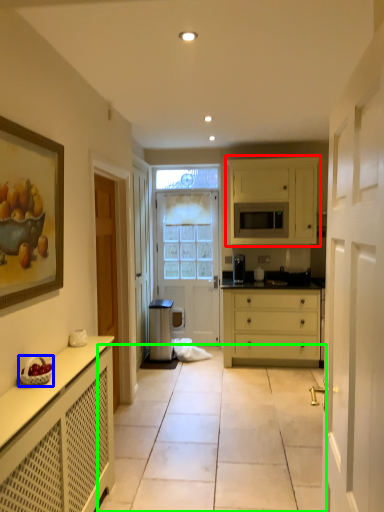
Question: Which is farther away from cabinetry (highlighted by a red box)? fruit dish (highlighted by a blue box) or path (highlighted by a green box)?

Choices:
 (A) fruit dish
 (B) path

Answer: (A)